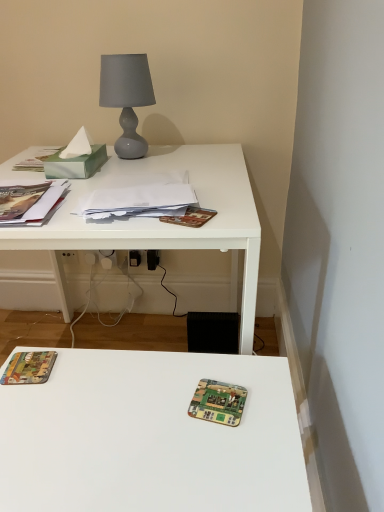
Locate an element on the screen. The image size is (384, 512). empty space that is in between white paper stack at center and brown textured paper at center, arranged as the second paperback book when viewed from the left is located at coordinates (170, 214).